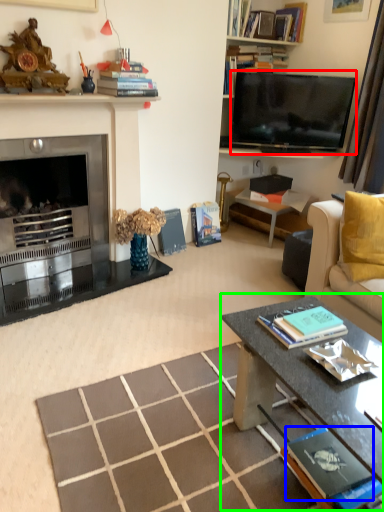
Question: Considering the real-world distances, which object is farthest from television (highlighted by a red box)? book (highlighted by a blue box) or coffee table (highlighted by a green box)?

Choices:
 (A) book
 (B) coffee table

Answer: (A)